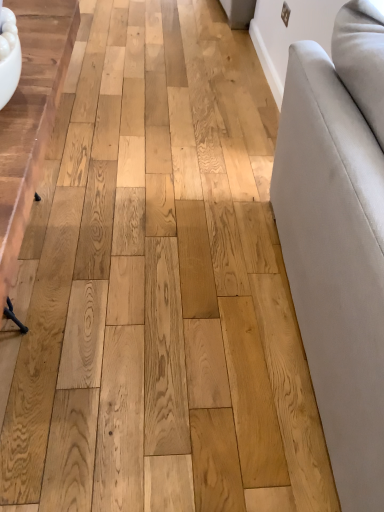
Identify the location of suede-like beige sofa at right. The height and width of the screenshot is (512, 384). (339, 238).

The height and width of the screenshot is (512, 384). Describe the element at coordinates (339, 238) in the screenshot. I see `suede-like beige sofa at right` at that location.

Find the location of a particular element. suede-like beige sofa at right is located at coordinates (339, 238).